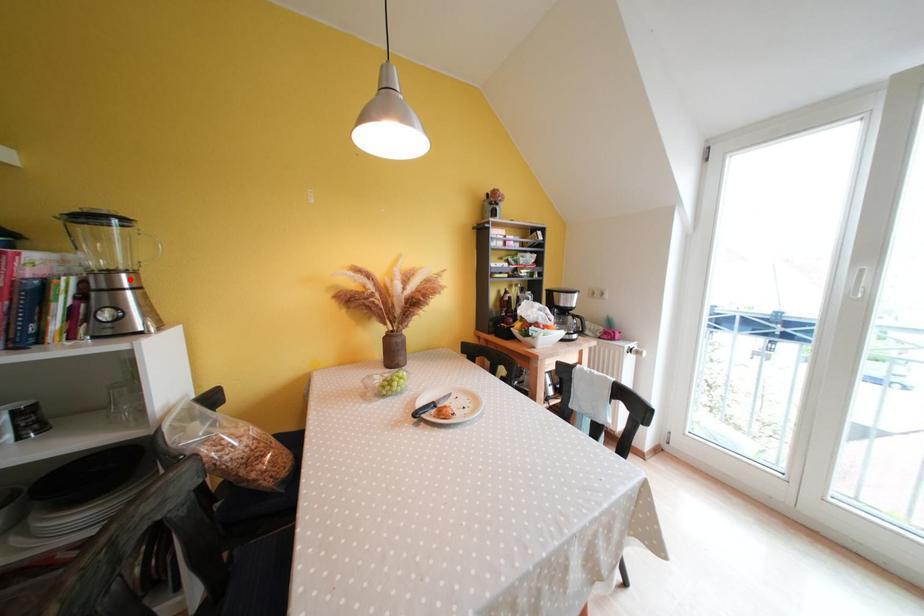
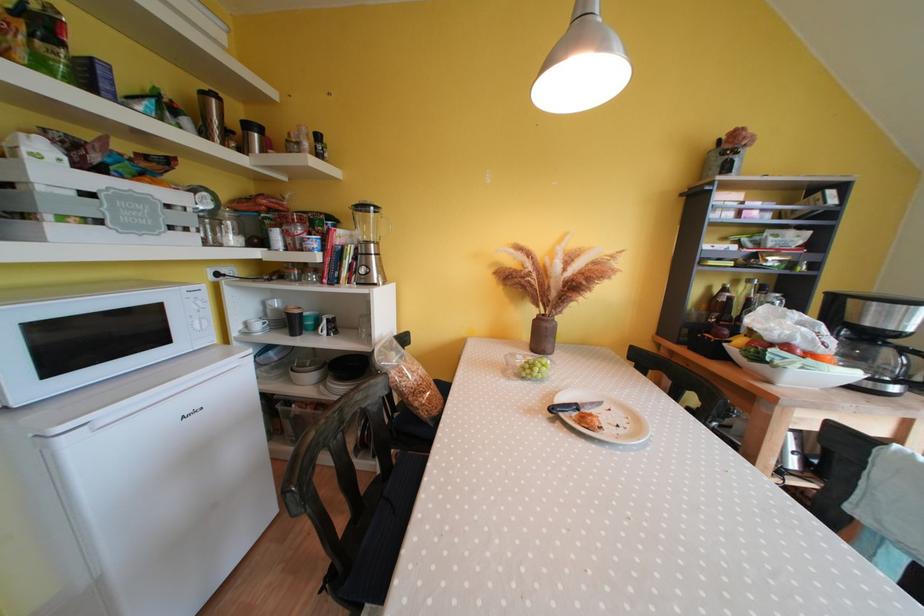
Find the pixel in the second image that matches the highlighted location in the first image.

(379, 249)